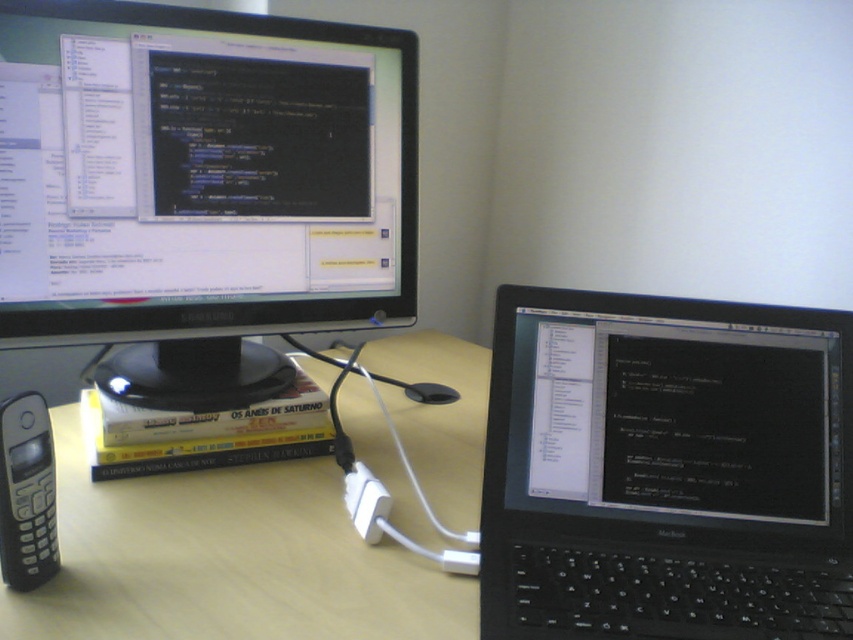
You are organizing a desk space and need to place a new keyboard that is 0.5 meters wide. Given the black plastic laptop at center and the light brown wood computer desk at center, can the keyboard fit on the desk next to the laptop without overlapping?

The black plastic laptop at center is narrower than the light brown wood computer desk at center, so there should be enough space for the keyboard to fit next to it without overlapping.

You are organizing your desk and want to place a new item between the light brown wood computer desk at center and the black plastic phone at left. Is the space between them sufficient to fit an item that is 10 cm wide?

The light brown wood computer desk at center is closer to the viewer than the black plastic phone at left, so the space between them is not sufficient to fit an item that is 10 cm wide.